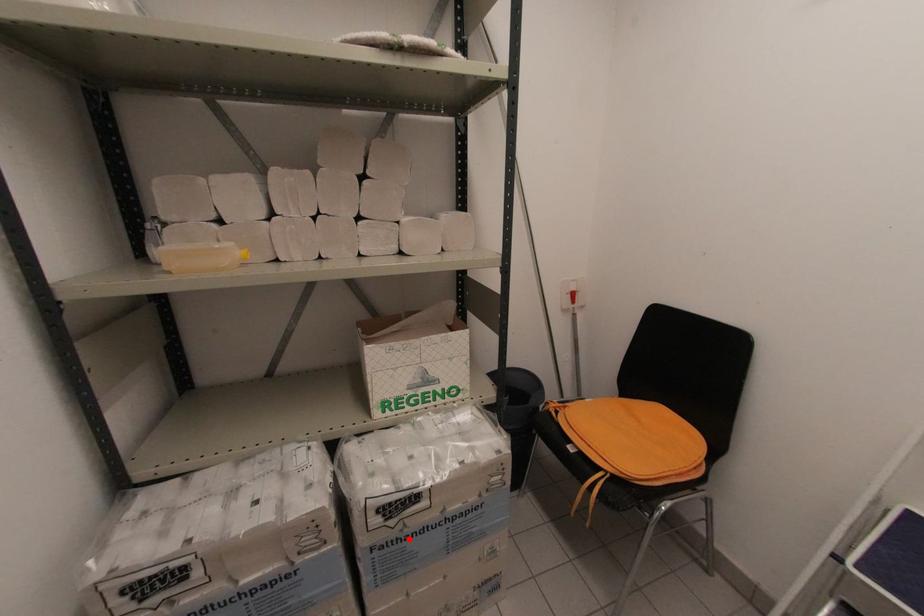
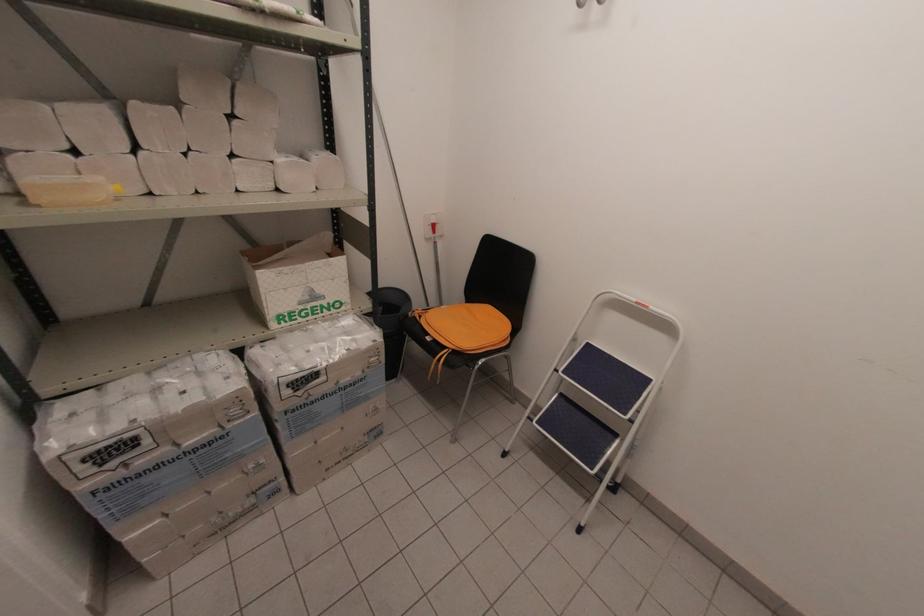
Question: A red point is marked in image1. In image2, is the corresponding 3D point closer to the camera or farther? Reply with the corresponding letter.

Choices:
 (A) The corresponding 3D point is closer.
 (B) The corresponding 3D point is farther.

Answer: (A)